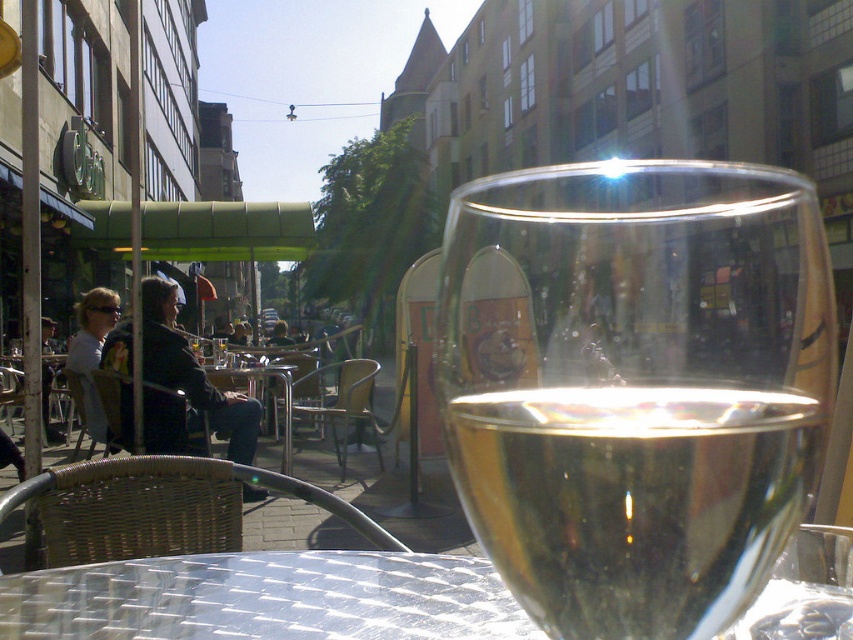
Can you confirm if clear glass wine glass at center is positioned below transparent glass table at center?

No, clear glass wine glass at center is not below transparent glass table at center.

Is point (766, 477) closer to camera compared to point (418, 573)?

Yes, it is in front of point (418, 573).

What do you see at coordinates (635, 385) in the screenshot? Image resolution: width=853 pixels, height=640 pixels. I see `clear glass wine glass at center` at bounding box center [635, 385].

Find the location of a particular element. This screenshot has height=640, width=853. clear glass wine glass at center is located at coordinates (635, 385).